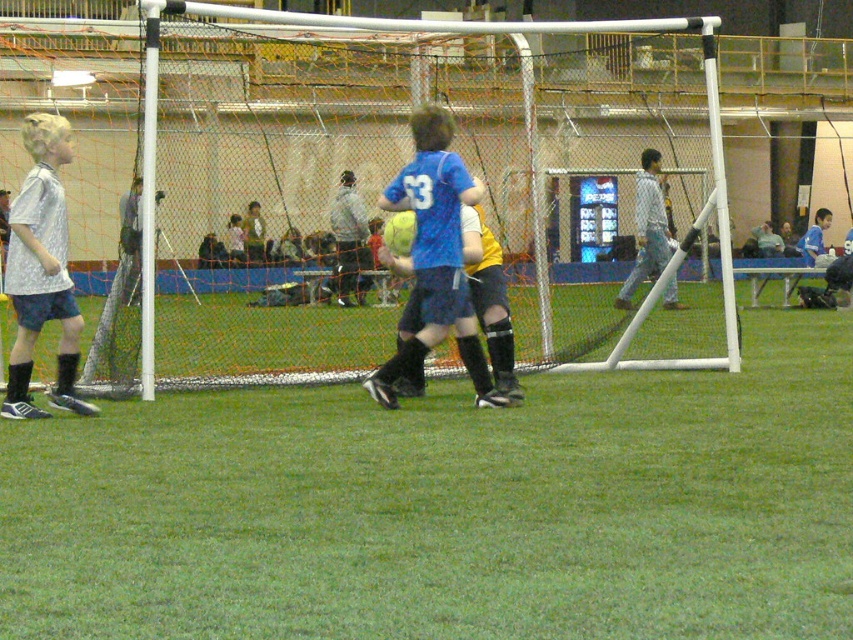
You are a soccer coach analyzing the field layout. The green grass at center is where the ball is placed for the penalty kick. Considering the silver metallic shirt at left belongs to the goalkeeper, can you determine if the goalkeeper has enough space to position themselves properly before the kick?

The green grass at center has a width less than the silver metallic shirt at left. Since the goalkeeper needs sufficient space to position themselves, the narrower width of the green grass at center may restrict the goalkeeper from moving freely, making it challenging to position properly before the kick.

You are a soccer player preparing to take a penalty kick. You notice the green grass at center and the silver metallic shirt at left in your line of sight. Which object is closer to you?

The silver metallic shirt at left is closer to you because it is positioned above the green grass at center, indicating it is in front of the grass.